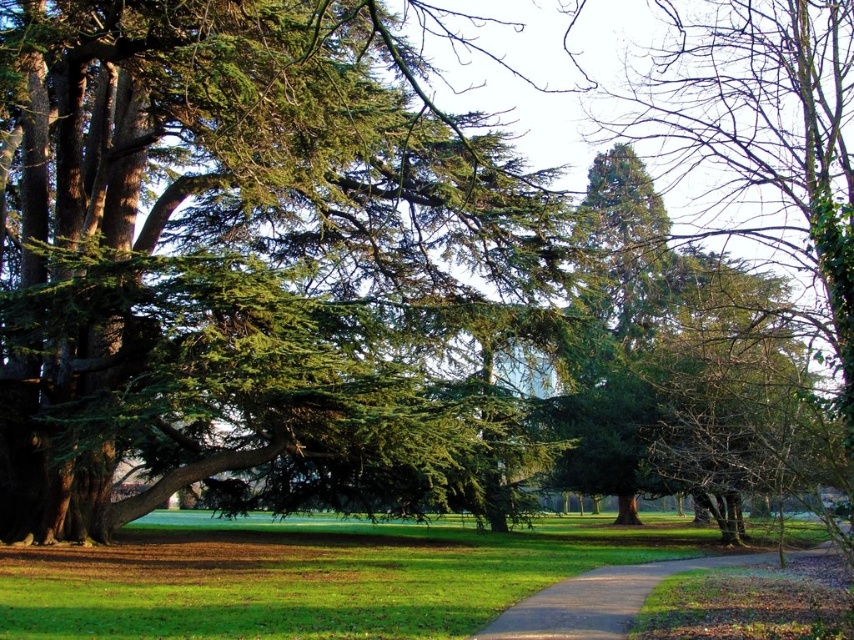
Is green grass at center wider than brown gravel path at center?

Correct, the width of green grass at center exceeds that of brown gravel path at center.

Is green grass at center to the left of brown gravel path at center from the viewer's perspective?

Correct, you'll find green grass at center to the left of brown gravel path at center.

Is point (143, 609) farther from viewer compared to point (515, 627)?

Yes.

This screenshot has height=640, width=854. I want to click on green grass at center, so click(309, 577).

Is green needle-like foliage at center taller than brown gravel path at center?

Yes.

Who is taller, green needle-like foliage at center or brown gravel path at center?

With more height is green needle-like foliage at center.

Between point (208, 35) and point (595, 625), which one is positioned behind?

Positioned behind is point (208, 35).

At what (x,y) coordinates should I click in order to perform the action: click on green needle-like foliage at center. Please return your answer as a coordinate pair (x, y). Looking at the image, I should click on (243, 253).

Does point (77, 308) come closer to viewer compared to point (178, 576)?

Yes, point (77, 308) is closer to viewer.

Image resolution: width=854 pixels, height=640 pixels. I want to click on green needle-like foliage at center, so click(x=243, y=253).